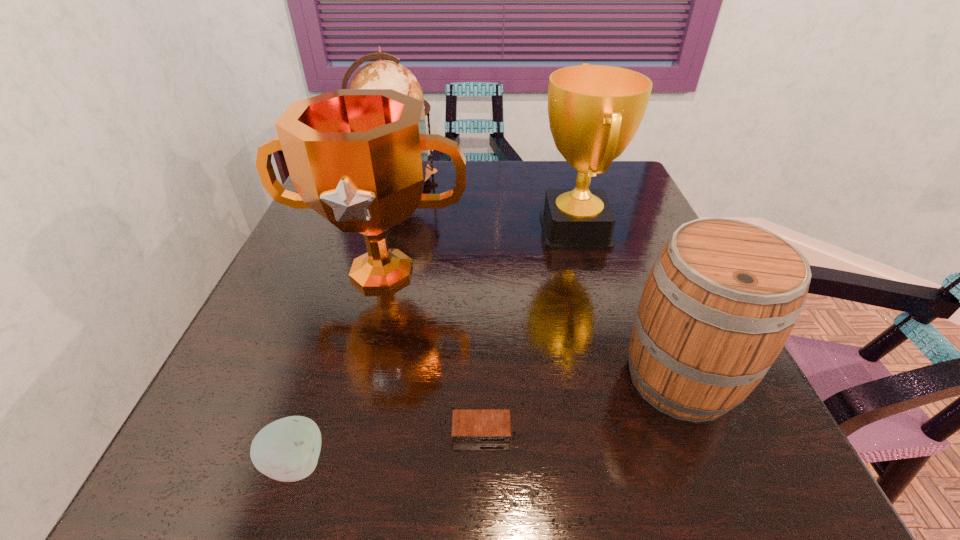
In order to click on globe in this screenshot , I will do `click(382, 74)`.

Identify the location of the right award. This screenshot has height=540, width=960. (594, 111).

Identify the location of the left award. (358, 157).

Locate an element on the screen. the third shortest object is located at coordinates (723, 295).

Locate an element on the screen. apple is located at coordinates (x=287, y=450).

The width and height of the screenshot is (960, 540). Find the location of `alarm clock`. alarm clock is located at coordinates (469, 426).

Locate an element on the screen. This screenshot has width=960, height=540. vacant space situated at the center of the globe is located at coordinates (465, 180).

Find the location of a particular element. blank area located 0.090m on the front-facing side of the right award is located at coordinates (500, 230).

In order to click on vacant region located on the front-facing side of the right award in this screenshot , I will do `click(406, 230)`.

The width and height of the screenshot is (960, 540). Find the location of `vacant space situated on the front-facing side of the right award`. vacant space situated on the front-facing side of the right award is located at coordinates (461, 230).